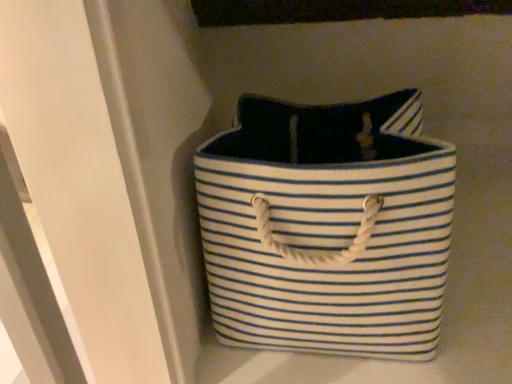
What is the approximate height of white striped fabric basket at center?

white striped fabric basket at center is 11.94 inches in height.

Locate an element on the screen. The height and width of the screenshot is (384, 512). white striped fabric basket at center is located at coordinates (327, 227).

What do you see at coordinates (327, 227) in the screenshot? The height and width of the screenshot is (384, 512). I see `white striped fabric basket at center` at bounding box center [327, 227].

Measure the distance between white striped fabric basket at center and camera.

white striped fabric basket at center and camera are 43.67 centimeters apart from each other.

Locate an element on the screen. Image resolution: width=512 pixels, height=384 pixels. white striped fabric basket at center is located at coordinates (327, 227).